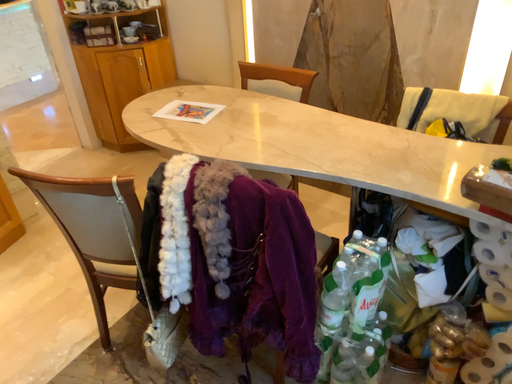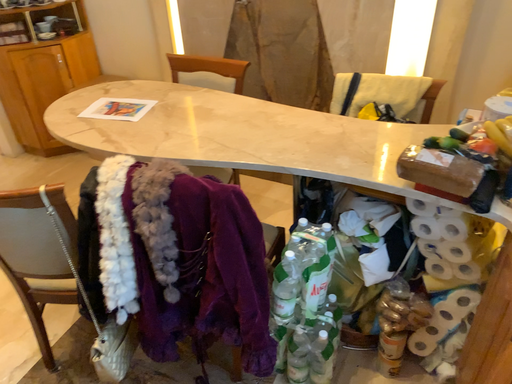
Question: Which way did the camera rotate in the video?

Choices:
 (A) rotated right
 (B) rotated left

Answer: (A)